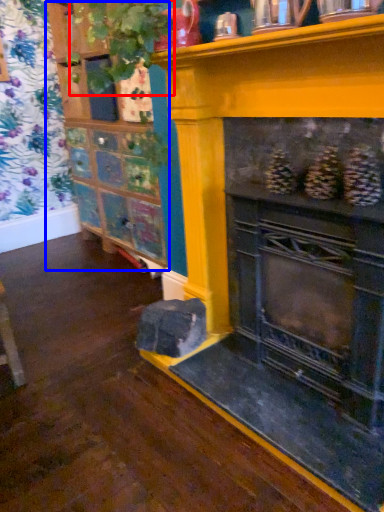
Question: Which point is further to the camera, plant (highlighted by a red box) or shelf (highlighted by a blue box)?

Choices:
 (A) plant
 (B) shelf

Answer: (A)